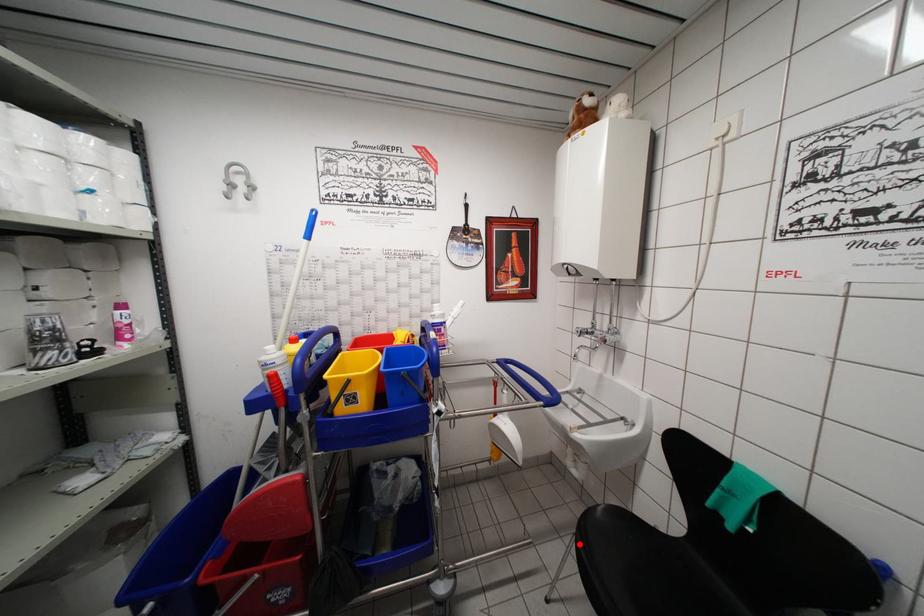
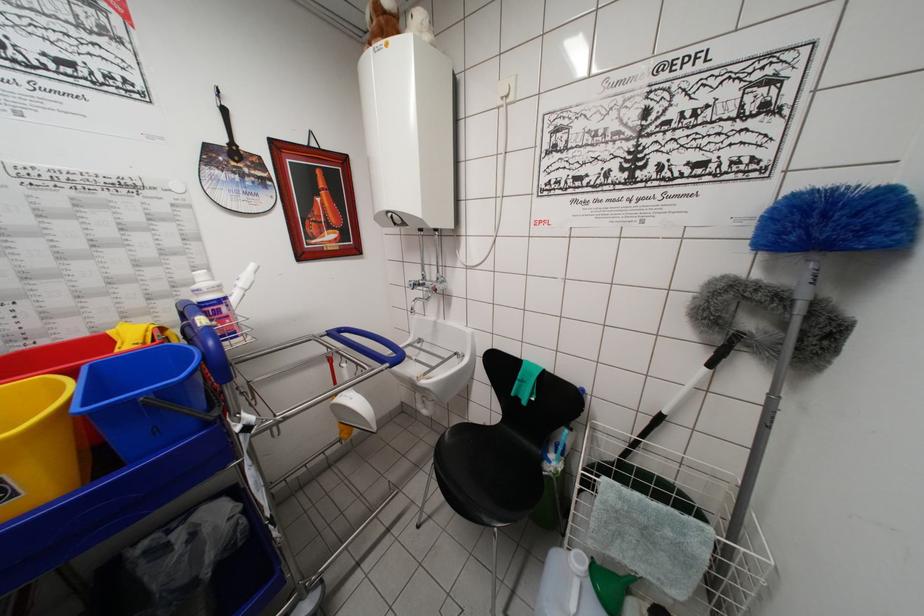
Find the pixel in the second image that matches the highlighted location in the first image.

(438, 472)